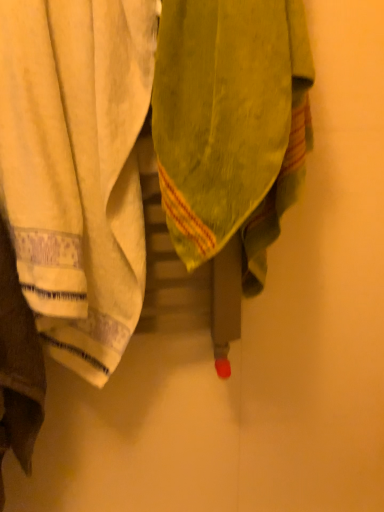
Describe the element at coordinates (77, 169) in the screenshot. I see `white cotton towel at left, the first towel when ordered from left to right` at that location.

In order to click on white cotton towel at left, the first towel when ordered from left to right in this screenshot , I will do `click(77, 169)`.

Measure the distance between point (23,137) and camera.

62.50 centimeters.

Identify the location of green textured towel at center, which ranks as the 2th towel in left-to-right order. The height and width of the screenshot is (512, 384). (231, 123).

The image size is (384, 512). Describe the element at coordinates (231, 123) in the screenshot. I see `green textured towel at center, which ranks as the 2th towel in left-to-right order` at that location.

Locate an element on the screen. Image resolution: width=384 pixels, height=512 pixels. white cotton towel at left, the first towel when ordered from left to right is located at coordinates (77, 169).

Does green textured towel at center, acting as the 1th towel starting from the right, appear on the right side of white cotton towel at left, the first towel when ordered from left to right?

Yes.

Looking at this image, between green textured towel at center, which ranks as the 2th towel in left-to-right order, and white cotton towel at left, which is counted as the 2th towel, starting from the right, which one is positioned in front?

green textured towel at center, which ranks as the 2th towel in left-to-right order.

Which is closer, (285, 129) or (104, 149)?

The point (285, 129) is more forward.

From the image's perspective, between green textured towel at center, acting as the 1th towel starting from the right, and white cotton towel at left, the first towel when ordered from left to right, who is located below?

white cotton towel at left, the first towel when ordered from left to right, is shown below in the image.

From a real-world perspective, which is physically below, green textured towel at center, which ranks as the 2th towel in left-to-right order, or white cotton towel at left, which is counted as the 2th towel, starting from the right?

In real-world perspective, white cotton towel at left, which is counted as the 2th towel, starting from the right, is lower.

Does green textured towel at center, which ranks as the 2th towel in left-to-right order, have a greater width compared to white cotton towel at left, which is counted as the 2th towel, starting from the right?

Correct, the width of green textured towel at center, which ranks as the 2th towel in left-to-right order, exceeds that of white cotton towel at left, which is counted as the 2th towel, starting from the right.

Who is shorter, green textured towel at center, which ranks as the 2th towel in left-to-right order, or white cotton towel at left, the first towel when ordered from left to right?

With less height is green textured towel at center, which ranks as the 2th towel in left-to-right order.

Is green textured towel at center, which ranks as the 2th towel in left-to-right order, bigger or smaller than white cotton towel at left, the first towel when ordered from left to right?

In the image, green textured towel at center, which ranks as the 2th towel in left-to-right order, appears to be smaller than white cotton towel at left, the first towel when ordered from left to right.

Would you say white cotton towel at left, the first towel when ordered from left to right, is part of green textured towel at center, which ranks as the 2th towel in left-to-right order,'s contents?

That's incorrect, white cotton towel at left, the first towel when ordered from left to right, is not inside green textured towel at center, which ranks as the 2th towel in left-to-right order.

Is green textured towel at center, acting as the 1th towel starting from the right, far away from white cotton towel at left, which is counted as the 2th towel, starting from the right?

No.

Is green textured towel at center, acting as the 1th towel starting from the right, looking in the opposite direction of white cotton towel at left, the first towel when ordered from left to right?

green textured towel at center, acting as the 1th towel starting from the right, is not turned away from white cotton towel at left, the first towel when ordered from left to right.

How many degrees apart are the facing directions of green textured towel at center, which ranks as the 2th towel in left-to-right order, and white cotton towel at left, which is counted as the 2th towel, starting from the right?

0.000412 degrees separate the facing orientations of green textured towel at center, which ranks as the 2th towel in left-to-right order, and white cotton towel at left, which is counted as the 2th towel, starting from the right.

The height and width of the screenshot is (512, 384). Identify the location of towel to the right of white cotton towel at left, which is counted as the 2th towel, starting from the right. (231, 123).

Considering the relative positions of white cotton towel at left, the first towel when ordered from left to right, and green textured towel at center, which ranks as the 2th towel in left-to-right order, in the image provided, is white cotton towel at left, the first towel when ordered from left to right, to the right of green textured towel at center, which ranks as the 2th towel in left-to-right order, from the viewer's perspective?

No.

Does white cotton towel at left, which is counted as the 2th towel, starting from the right, lie behind green textured towel at center, acting as the 1th towel starting from the right?

Yes.

Which point is more distant from viewer, (98,262) or (207,85)?

The point (98,262) is more distant.

From the picture: From the image's perspective, which is above, white cotton towel at left, the first towel when ordered from left to right, or green textured towel at center, which ranks as the 2th towel in left-to-right order?

From the image's view, green textured towel at center, which ranks as the 2th towel in left-to-right order, is above.

From a real-world perspective, which object stands above the other?

green textured towel at center, which ranks as the 2th towel in left-to-right order.

From the picture: Can you confirm if white cotton towel at left, which is counted as the 2th towel, starting from the right, is thinner than green textured towel at center, which ranks as the 2th towel in left-to-right order?

Yes, white cotton towel at left, which is counted as the 2th towel, starting from the right, is thinner than green textured towel at center, which ranks as the 2th towel in left-to-right order.

Can you confirm if white cotton towel at left, which is counted as the 2th towel, starting from the right, is taller than green textured towel at center, acting as the 1th towel starting from the right?

Yes.

Which of these two, white cotton towel at left, the first towel when ordered from left to right, or green textured towel at center, acting as the 1th towel starting from the right, is smaller?

green textured towel at center, acting as the 1th towel starting from the right, is smaller.

Can green textured towel at center, which ranks as the 2th towel in left-to-right order, be found inside white cotton towel at left, the first towel when ordered from left to right?

No.

Is white cotton towel at left, which is counted as the 2th towel, starting from the right, next to green textured towel at center, acting as the 1th towel starting from the right, and touching it?

No, white cotton towel at left, which is counted as the 2th towel, starting from the right, is not with green textured towel at center, acting as the 1th towel starting from the right.

Is white cotton towel at left, which is counted as the 2th towel, starting from the right, turned away from green textured towel at center, acting as the 1th towel starting from the right?

white cotton towel at left, which is counted as the 2th towel, starting from the right, is not turned away from green textured towel at center, acting as the 1th towel starting from the right.

I want to click on towel that is above the white cotton towel at left, which is counted as the 2th towel, starting from the right (from a real-world perspective), so tap(231, 123).

Locate an element on the screen. The image size is (384, 512). towel that appears below the green textured towel at center, which ranks as the 2th towel in left-to-right order (from a real-world perspective) is located at coordinates point(77,169).

Where is `towel on the right of white cotton towel at left, the first towel when ordered from left to right`? This screenshot has width=384, height=512. towel on the right of white cotton towel at left, the first towel when ordered from left to right is located at coordinates (231, 123).